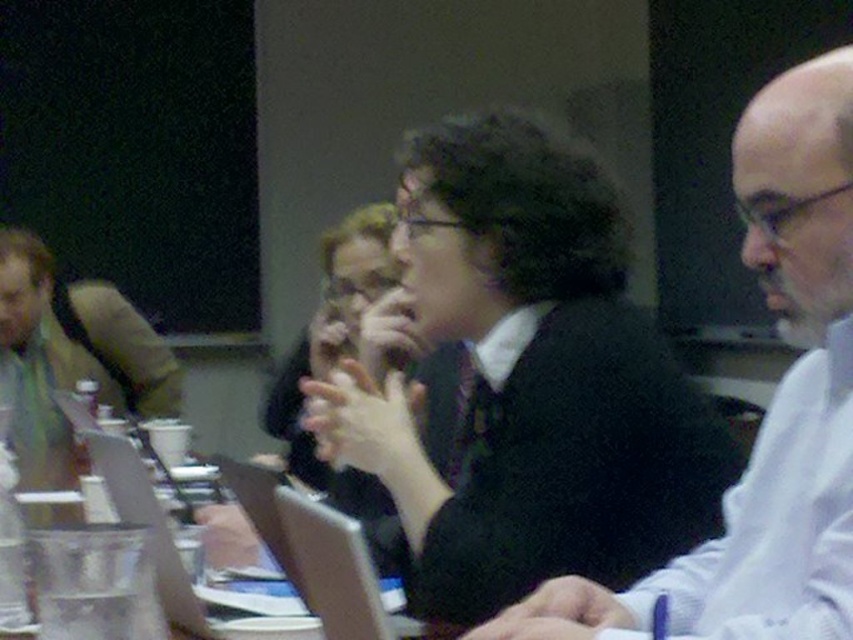
You are a service robot with a width of 10 inches. You need to pass between the black matte suit at center and the black sweater at center. Is there enough space for you to move through?

The distance between the black matte suit at center and the black sweater at center is 9.97 inches, which is slightly less than your width of 10 inches. Therefore, there is not enough space for you to pass through.

Based on the coordinates provided, what object is located at point (529, 381) in the image?

The point (529, 381) corresponds to the black matte suit at center.